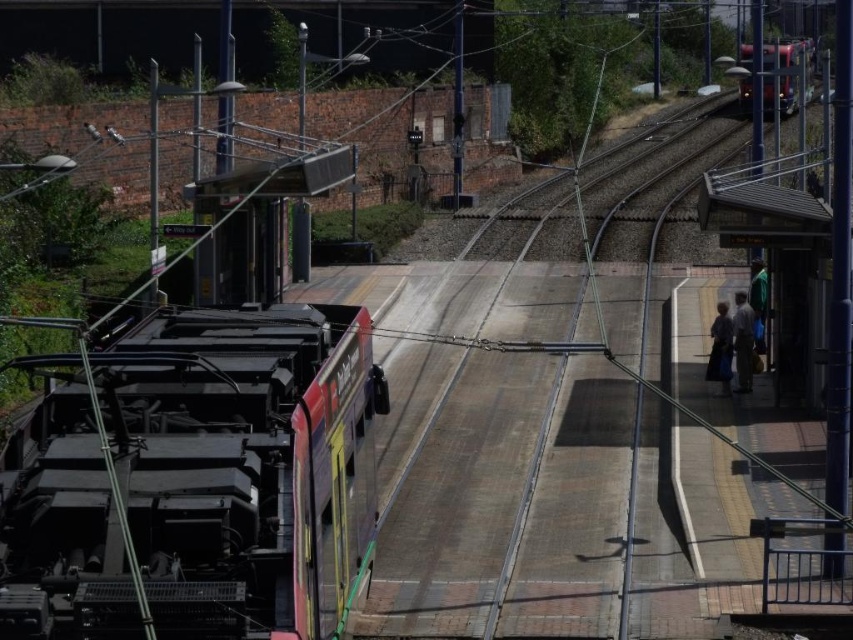
Who is positioned more to the left, light brown fabric coat at right or dark gray fabric bag at right?

dark gray fabric bag at right is more to the left.

Who is lower down, light brown fabric coat at right or dark gray fabric bag at right?

dark gray fabric bag at right is below.

Does point (740, 317) lie in front of point (715, 346)?

Yes, it is.

Identify the location of light brown fabric coat at right. Image resolution: width=853 pixels, height=640 pixels. (743, 340).

Between point (193, 372) and point (763, 58), which one is positioned in front?

Positioned in front is point (193, 372).

Does point (28, 440) come in front of point (785, 115)?

Yes, it is in front of point (785, 115).

Between point (305, 518) and point (785, 90), which one is positioned behind?

The point (785, 90) is behind.

This screenshot has height=640, width=853. In order to click on metallic red train at left in this screenshot , I will do `click(195, 481)`.

Between metallic red train at left and dark gray fabric bag at right, which one appears on the left side from the viewer's perspective?

Positioned to the left is metallic red train at left.

Who is positioned more to the right, metallic red train at left or dark gray fabric bag at right?

dark gray fabric bag at right

At what (x,y) coordinates should I click in order to perform the action: click on metallic red train at left. Please return your answer as a coordinate pair (x, y). Looking at the image, I should click on (195, 481).